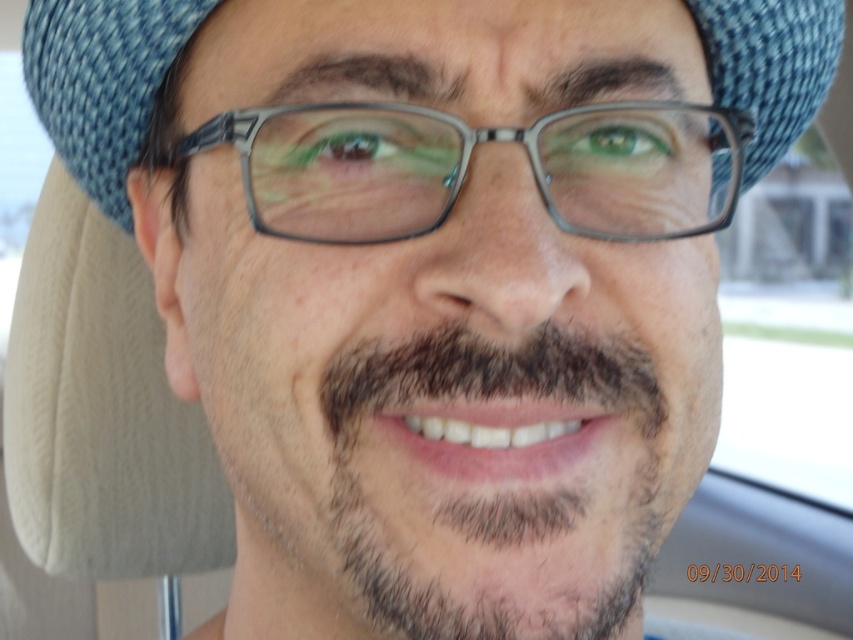
Which is in front, point (611, 445) or point (697, 108)?

Positioned in front is point (611, 445).

Can you confirm if dark brown fuzzy beard at center is positioned below clear plastic glasses at center?

Yes.

Identify the location of dark brown fuzzy beard at center. Image resolution: width=853 pixels, height=640 pixels. (445, 490).

Locate an element on the screen. dark brown fuzzy beard at center is located at coordinates (445, 490).

What do you see at coordinates (467, 163) in the screenshot? I see `clear plastic glasses at center` at bounding box center [467, 163].

Which is behind, point (570, 154) or point (100, 81)?

The point (100, 81) is behind.

The height and width of the screenshot is (640, 853). In order to click on clear plastic glasses at center in this screenshot , I will do `click(467, 163)`.

The image size is (853, 640). What are the coordinates of `clear plastic glasses at center` in the screenshot? It's located at (467, 163).

Which is below, dark brown fuzzy beard at center or blue textured hat at center?

dark brown fuzzy beard at center

Between dark brown fuzzy beard at center and blue textured hat at center, which one appears on the left side from the viewer's perspective?

dark brown fuzzy beard at center

Is point (264, 506) more distant than point (819, 51)?

That is False.

Identify the location of dark brown fuzzy beard at center. This screenshot has width=853, height=640. (445, 490).